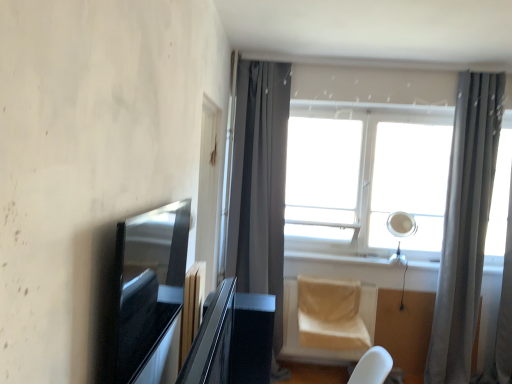
Question: Would you say white glass window at center is a long distance from glossy black table at center?

Choices:
 (A) yes
 (B) no

Answer: (A)

Question: Is white glass window at center completely or partially outside of glossy black table at center?

Choices:
 (A) no
 (B) yes

Answer: (B)

Question: Does white glass window at center have a larger size compared to glossy black table at center?

Choices:
 (A) yes
 (B) no

Answer: (A)

Question: Is white glass window at center at the right side of glossy black table at center?

Choices:
 (A) yes
 (B) no

Answer: (A)

Question: Can you confirm if white glass window at center is wider than glossy black table at center?

Choices:
 (A) no
 (B) yes

Answer: (A)

Question: From a real-world perspective, does white glass window at center sit lower than glossy black table at center?

Choices:
 (A) no
 (B) yes

Answer: (A)

Question: Are beige fabric swivel chair at lower center and white plastic window sill at center making contact?

Choices:
 (A) no
 (B) yes

Answer: (A)

Question: Is white plastic window sill at center located within beige fabric swivel chair at lower center?

Choices:
 (A) no
 (B) yes

Answer: (A)

Question: Is beige fabric swivel chair at lower center taller than white plastic window sill at center?

Choices:
 (A) yes
 (B) no

Answer: (A)

Question: From a real-world perspective, is beige fabric swivel chair at lower center on white plastic window sill at center?

Choices:
 (A) no
 (B) yes

Answer: (A)

Question: Could you tell me if beige fabric swivel chair at lower center is turned towards white plastic window sill at center?

Choices:
 (A) yes
 (B) no

Answer: (B)

Question: Considering the relative positions of beige fabric swivel chair at lower center and white plastic window sill at center in the image provided, is beige fabric swivel chair at lower center to the right of white plastic window sill at center from the viewer's perspective?

Choices:
 (A) yes
 (B) no

Answer: (B)

Question: From the image's perspective, is white glass window at center located beneath white plastic window sill at center?

Choices:
 (A) yes
 (B) no

Answer: (B)